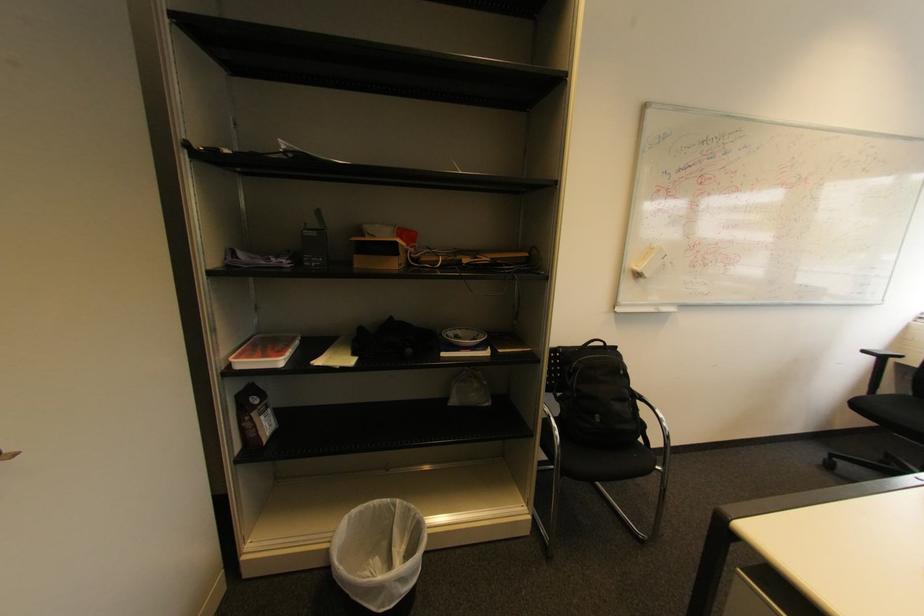
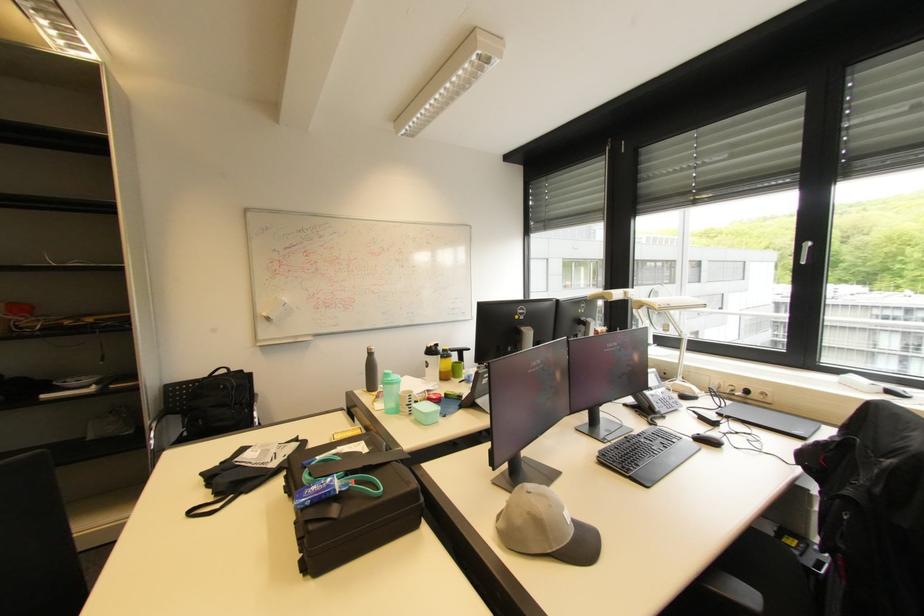
Locate, in the second image, the point that corresponds to point 643,276 in the first image.

(273, 320)